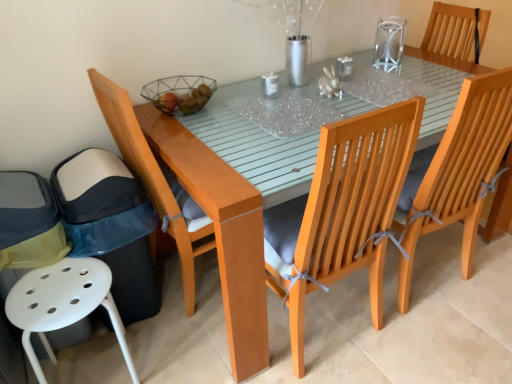
Find the location of a particular element. spots to the right of transparent glass table at upper center, arranged as the second glass table when viewed from the left is located at coordinates click(432, 77).